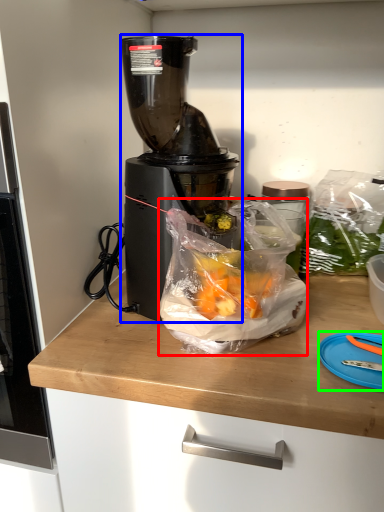
Question: Based on their relative distances, which object is nearer to waste (highlighted by a red box)? Choose from blender (highlighted by a blue box) and cutting board (highlighted by a green box).

Choices:
 (A) blender
 (B) cutting board

Answer: (A)